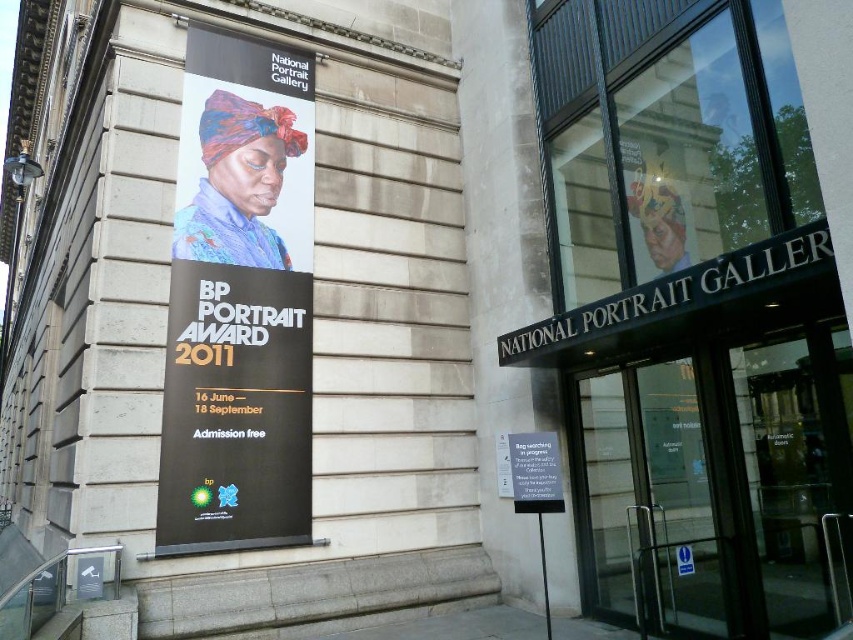
You are standing in front of the National Portrait Gallery and want to enter through the transparent glass door at center. Which side of the door should you look towards to see the matte black banner at upper left?

The matte black banner at upper left is to the left of the transparent glass door at center, so you should look to the left side of the door to see it.

You are standing in front of the National Portrait Gallery and want to take a photo of the BP Portrait Award 2011 banner. There are two points marked on the banner at coordinates point (x=590, y=554) and point (x=544, y=492). Which point is closer to the camera?

Point (x=544, y=492) is closer to the camera because point (x=590, y=554) is behind it.

You are standing in front of the National Portrait Gallery and want to locate the exhibition details about the BP Portrait Award 2011. Where should you look relative to the matte black banner at upper left?

The exhibition details are located below the matte black banner at upper left, as the banner is divided into two sections with the upper part showing a portrait and the lower part containing text about the exhibition.